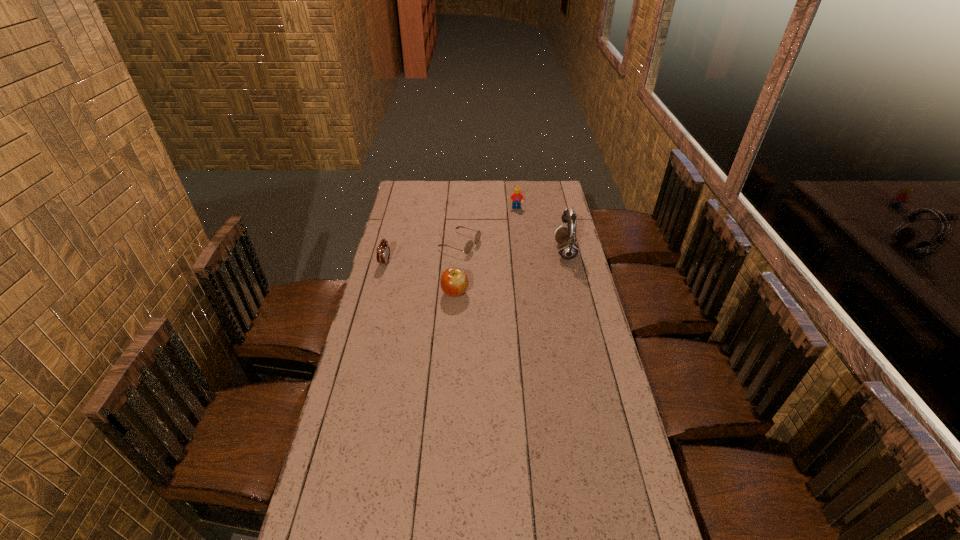
Where is `apple`? The image size is (960, 540). apple is located at coordinates (454, 282).

At what (x,y) coordinates should I click in order to perform the action: click on the tallest object. Please return your answer as a coordinate pair (x, y). Looking at the image, I should click on (568, 249).

Find the location of a particular element. This screenshot has height=540, width=960. the rightmost object is located at coordinates (568, 249).

The height and width of the screenshot is (540, 960). I want to click on Lego, so click(516, 198).

You are a GUI agent. You are given a task and a screenshot of the screen. Output one action in this format:
    pyautogui.click(x=<x>, y=<y>)
    Task: Click on the fourth object from left to right
    The height and width of the screenshot is (540, 960).
    Given the screenshot: What is the action you would take?
    pyautogui.click(x=516, y=198)

Locate an element on the screen. This screenshot has height=540, width=960. sunglasses is located at coordinates (468, 247).

Locate an element on the screen. alarm clock is located at coordinates (383, 250).

Find the location of a particular element. This screenshot has width=960, height=540. vacant space located on the back of the nearest object is located at coordinates (457, 264).

Locate an element on the screen. vacant space located on the face of the Lego is located at coordinates (516, 255).

The height and width of the screenshot is (540, 960). In order to click on vacant space situated on the face of the Lego in this screenshot , I will do `click(516, 249)`.